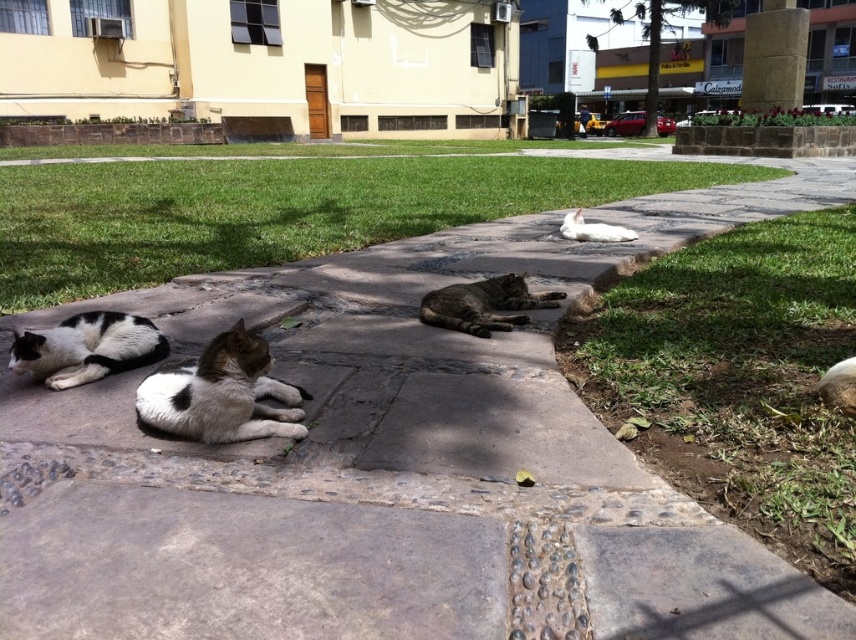
Question: Can you confirm if gray striped cat at center is smaller than white fur cat at center?

Choices:
 (A) yes
 (B) no

Answer: (B)

Question: Is black-and-white fur cat at lower left to the right of white fur cat at center from the viewer's perspective?

Choices:
 (A) yes
 (B) no

Answer: (B)

Question: Which object is the closest to the green grass at lower right?

Choices:
 (A) gray concrete pavement at center
 (B) white fur cat at center

Answer: (B)

Question: Among these points, which one is nearest to the camera?

Choices:
 (A) (609, 230)
 (B) (266, 269)
 (C) (703, 301)
 (D) (49, 353)

Answer: (D)

Question: Does green grass at center have a smaller size compared to white and gray fur cat at center?

Choices:
 (A) no
 (B) yes

Answer: (A)

Question: Which of the following is the farthest from the observer?

Choices:
 (A) black-and-white fur cat at lower left
 (B) white and gray fur cat at center
 (C) gray striped cat at center
 (D) green grass at center

Answer: (D)